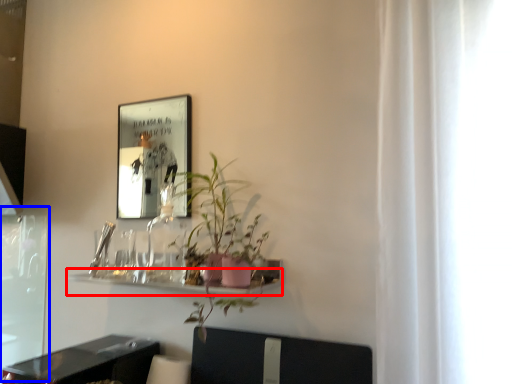
Question: Which point is closer to the camera, shelf (highlighted by a red box) or screen door (highlighted by a blue box)?

Choices:
 (A) shelf
 (B) screen door

Answer: (A)